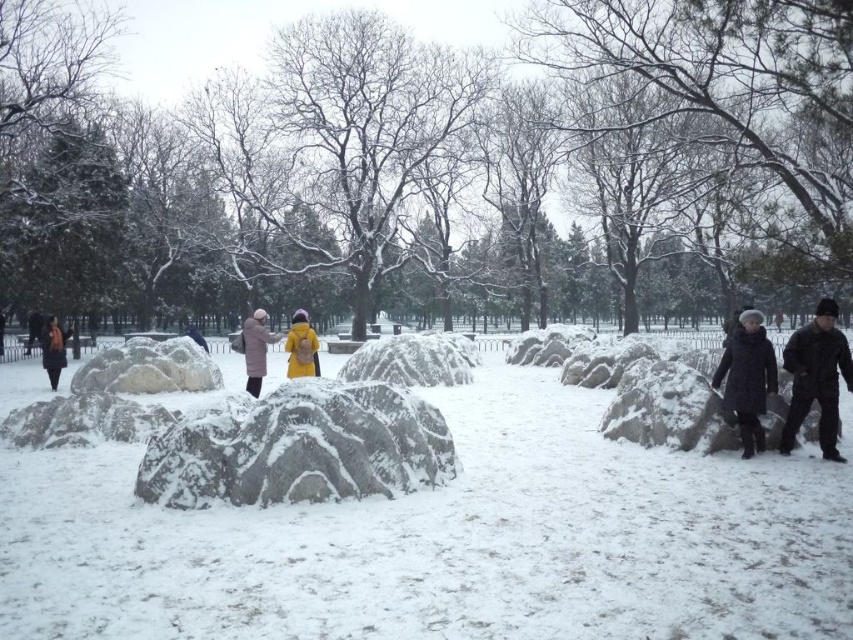
You are a photographer setting up equipment in the snowy park. You have two jackets, the black matte jacket at right and the matte black jacket at left. Which jacket takes up more space on the ground?

The matte black jacket at left occupies more space on the ground than the black matte jacket at right.

You are a hiker who has just arrived at the park. You see the white textured snow at center and the yellow matte jacket at center. How far apart are these two items?

The white textured snow at center and the yellow matte jacket at center are 5.64 meters apart.

You are a photographer standing in the snowy park and want to take a photo that includes both the yellow matte jacket at center and the matte black jacket at left. Which jacket will appear larger in the photo?

The yellow matte jacket at center will appear larger in the photo because it is closer to the viewer than the matte black jacket at left.